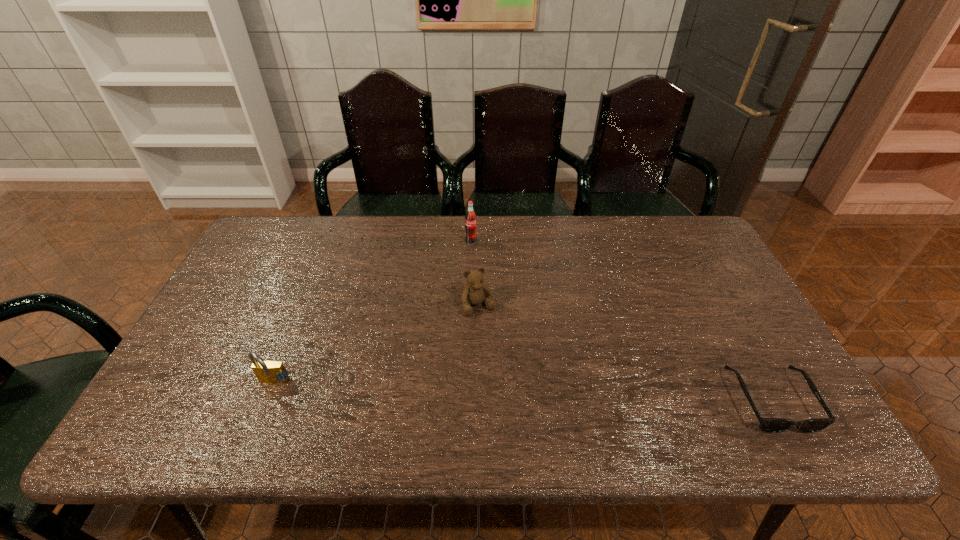
You are a GUI agent. You are given a task and a screenshot of the screen. Output one action in this format:
    pyautogui.click(x=<x>, y=<y>)
    Task: Click on the padlock
    
    Given the screenshot: What is the action you would take?
    pyautogui.click(x=272, y=372)

Locate an element on the screen. The width and height of the screenshot is (960, 540). sunglasses is located at coordinates (768, 425).

Where is `the rightmost object`? The width and height of the screenshot is (960, 540). the rightmost object is located at coordinates (768, 425).

Image resolution: width=960 pixels, height=540 pixels. I want to click on soda bottle, so click(x=470, y=218).

The width and height of the screenshot is (960, 540). I want to click on the farthest object, so click(x=470, y=218).

Identify the location of the third nearest object. This screenshot has height=540, width=960. (476, 292).

Locate an element on the screen. free point located on the label of the farthest object is located at coordinates (491, 280).

In order to click on vacant region located 0.060m on the label of the farthest object in this screenshot , I will do `click(479, 256)`.

Identify the location of vacant space located on the label of the farthest object. tap(478, 254).

The height and width of the screenshot is (540, 960). Identify the location of vacant position located 0.220m on the front-facing side of the third nearest object. (515, 382).